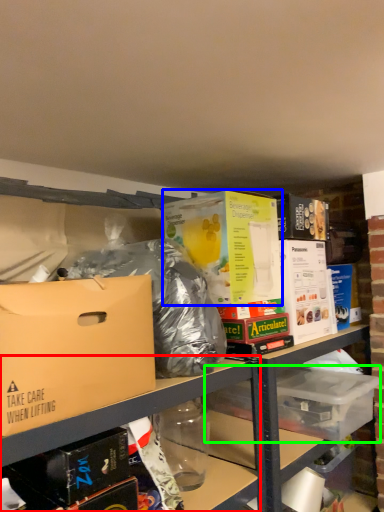
Question: Which object is the closest to the shelf (highlighted by a red box)? Choose among these: box (highlighted by a blue box) or storage box (highlighted by a green box).

Choices:
 (A) box
 (B) storage box

Answer: (A)